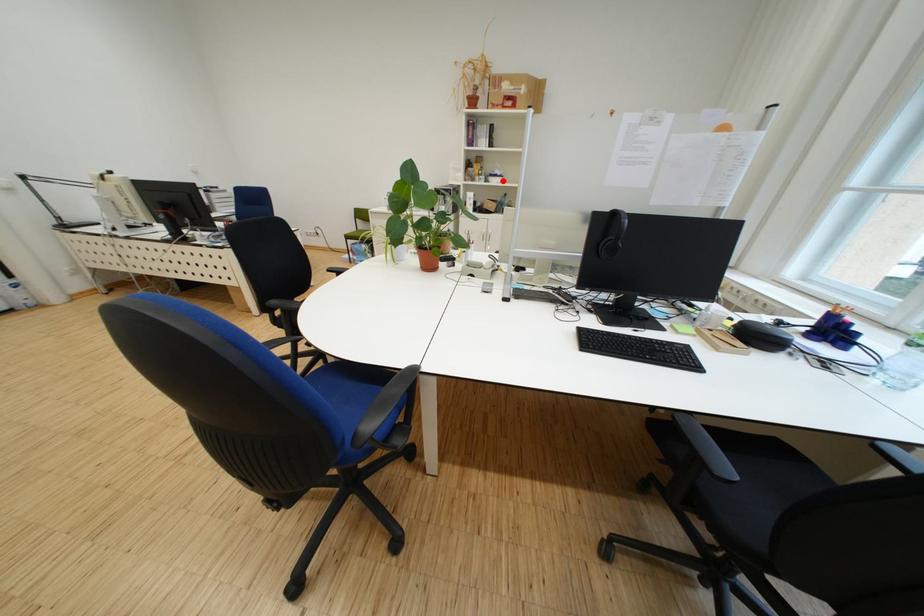
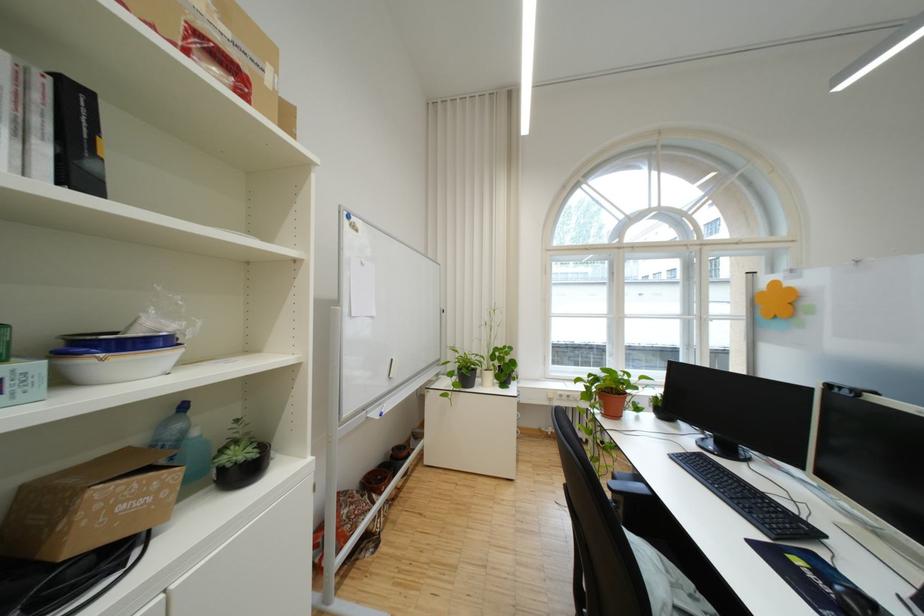
Locate, in the second image, the point that corresponds to the highlighted location in the first image.

(117, 365)